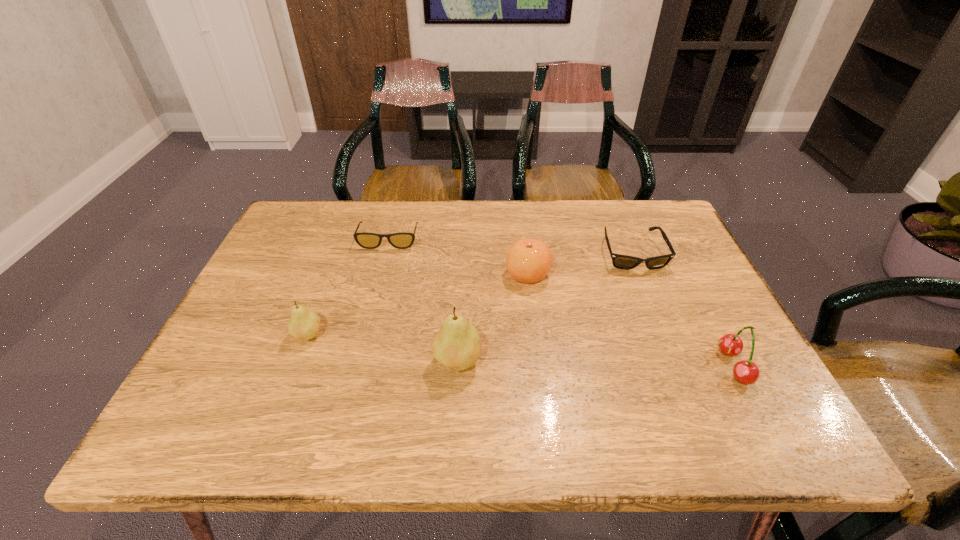
I want to click on sunglasses positioned at the right edge, so click(625, 262).

The image size is (960, 540). I want to click on cherry positioned at the right edge, so click(746, 372).

Locate an element on the screen. object that is at the far right corner is located at coordinates (625, 262).

The height and width of the screenshot is (540, 960). Identify the location of object that is at the near right corner. (746, 372).

The image size is (960, 540). I want to click on vacant space at the far edge of the desktop, so click(444, 230).

This screenshot has height=540, width=960. What are the coordinates of `vacant space at the near edge of the desktop` in the screenshot? It's located at (397, 386).

The width and height of the screenshot is (960, 540). Identify the location of vacant area at the left edge. (282, 267).

Identify the location of free location at the far right corner of the desktop. (623, 204).

The image size is (960, 540). Find the location of `empty location between the fourth object from right to left and the fourth object from left to right`. empty location between the fourth object from right to left and the fourth object from left to right is located at coordinates (492, 318).

You are a GUI agent. You are given a task and a screenshot of the screen. Output one action in this format:
    pyautogui.click(x=<x>, y=<y>)
    Task: Click on the vacant space that is in between the right sunglasses and the taller pear
    
    Given the screenshot: What is the action you would take?
    pyautogui.click(x=545, y=307)